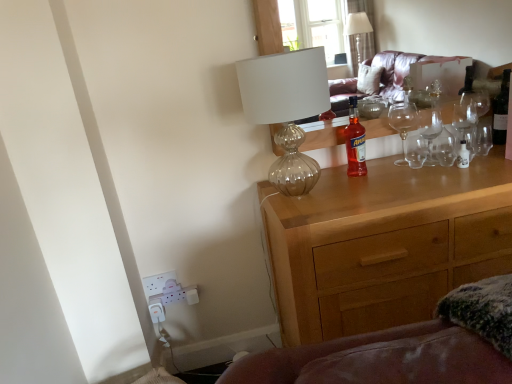
At what (x,y) coordinates should I click in order to perform the action: click on free space that is in between translucent glass lamp at upper center and dark glass wine bottle at upper right. Please return your answer as a coordinate pair (x, y). Looking at the image, I should click on (407, 173).